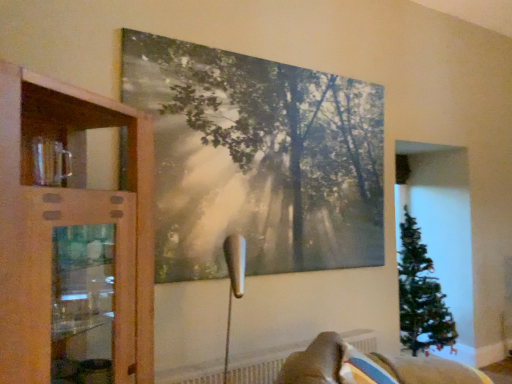
Question: Considering the relative positions of velvet beige sofa at lower right and white textured radiator at lower center in the image provided, is velvet beige sofa at lower right in front of white textured radiator at lower center?

Choices:
 (A) yes
 (B) no

Answer: (A)

Question: Can you confirm if velvet beige sofa at lower right is positioned to the right of white textured radiator at lower center?

Choices:
 (A) no
 (B) yes

Answer: (B)

Question: Can you confirm if velvet beige sofa at lower right is bigger than white textured radiator at lower center?

Choices:
 (A) yes
 (B) no

Answer: (A)

Question: Is velvet beige sofa at lower right aimed at white textured radiator at lower center?

Choices:
 (A) yes
 (B) no

Answer: (B)

Question: Is velvet beige sofa at lower right in contact with white textured radiator at lower center?

Choices:
 (A) yes
 (B) no

Answer: (B)

Question: Considering their positions, is velvet beige sofa at lower right located in front of or behind matte canvas painting at upper center?

Choices:
 (A) behind
 (B) front

Answer: (B)

Question: Considering the positions of velvet beige sofa at lower right and matte canvas painting at upper center in the image, is velvet beige sofa at lower right bigger or smaller than matte canvas painting at upper center?

Choices:
 (A) small
 (B) big

Answer: (B)

Question: From a real-world perspective, is velvet beige sofa at lower right physically located above or below matte canvas painting at upper center?

Choices:
 (A) above
 (B) below

Answer: (B)

Question: Is velvet beige sofa at lower right inside the boundaries of matte canvas painting at upper center, or outside?

Choices:
 (A) outside
 (B) inside

Answer: (A)

Question: In terms of width, does matte canvas painting at upper center look wider or thinner when compared to velvet beige sofa at lower right?

Choices:
 (A) thin
 (B) wide

Answer: (A)

Question: Is matte canvas painting at upper center situated inside velvet beige sofa at lower right or outside?

Choices:
 (A) inside
 (B) outside

Answer: (B)

Question: Is matte canvas painting at upper center to the left or to the right of velvet beige sofa at lower right in the image?

Choices:
 (A) right
 (B) left

Answer: (B)

Question: Is matte canvas painting at upper center bigger or smaller than velvet beige sofa at lower right?

Choices:
 (A) small
 (B) big

Answer: (A)

Question: Relative to velvet beige sofa at lower right, is wooden cabinet at left in front or behind?

Choices:
 (A) front
 (B) behind

Answer: (A)

Question: Is point (19, 244) closer or farther from the camera than point (372, 379)?

Choices:
 (A) farther
 (B) closer

Answer: (B)